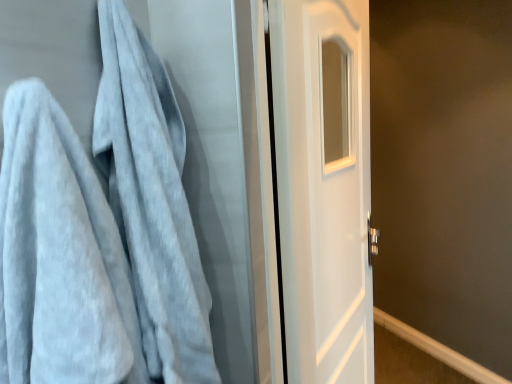
Measure the distance between point (82, 184) and camera.

Point (82, 184) and camera are 24.02 inches apart.

Measure the distance between light gray plush towel at left and camera.

They are 51.36 centimeters apart.

Image resolution: width=512 pixels, height=384 pixels. What are the coordinates of `light gray plush towel at left` in the screenshot? It's located at (101, 231).

The width and height of the screenshot is (512, 384). What do you see at coordinates (101, 231) in the screenshot?
I see `light gray plush towel at left` at bounding box center [101, 231].

The image size is (512, 384). In order to click on white glossy door at center in this screenshot , I will do `click(323, 187)`.

Describe the element at coordinates (323, 187) in the screenshot. This screenshot has height=384, width=512. I see `white glossy door at center` at that location.

Identify the location of light gray plush towel at left. This screenshot has width=512, height=384. (101, 231).

Considering the relative positions of white glossy door at center and light gray plush towel at left in the image provided, is white glossy door at center to the left of light gray plush towel at left from the viewer's perspective?

No, white glossy door at center is not to the left of light gray plush towel at left.

Which object is further away from the camera, white glossy door at center or light gray plush towel at left?

Positioned behind is white glossy door at center.

Is point (332, 108) farther from camera compared to point (40, 241)?

Yes, it is.

From the image's perspective, which one is positioned lower, white glossy door at center or light gray plush towel at left?

white glossy door at center is shown below in the image.

From a real-world perspective, who is located higher, white glossy door at center or light gray plush towel at left?

In real-world perspective, light gray plush towel at left is above.

Which of these two, white glossy door at center or light gray plush towel at left, is wider?

Wider between the two is light gray plush towel at left.

Is white glossy door at center taller or shorter than light gray plush towel at left?

Considering their sizes, white glossy door at center has more height than light gray plush towel at left.

In the scene shown: Between white glossy door at center and light gray plush towel at left, which one has smaller size?

With smaller size is light gray plush towel at left.

Is white glossy door at center inside the boundaries of light gray plush towel at left, or outside?

white glossy door at center lies outside light gray plush towel at left.

Is there a large distance between white glossy door at center and light gray plush towel at left?

white glossy door at center is actually quite close to light gray plush towel at left.

In the scene shown: Could you tell me if white glossy door at center is turned towards light gray plush towel at left?

No, white glossy door at center does not turn towards light gray plush towel at left.

The width and height of the screenshot is (512, 384). What are the coordinates of `towel lying in front of the white glossy door at center` in the screenshot? It's located at (101, 231).

Does light gray plush towel at left appear on the right side of white glossy door at center?

No, light gray plush towel at left is not to the right of white glossy door at center.

Considering the positions of objects light gray plush towel at left and white glossy door at center in the image provided, who is behind, light gray plush towel at left or white glossy door at center?

white glossy door at center is further from the camera.

Does point (114, 103) come farther from viewer compared to point (355, 380)?

That is False.

From the image's perspective, which is below, light gray plush towel at left or white glossy door at center?

white glossy door at center is shown below in the image.

From a real-world perspective, which is physically above, light gray plush towel at left or white glossy door at center?

light gray plush towel at left.

Which of these two, light gray plush towel at left or white glossy door at center, is thinner?

Thinner between the two is white glossy door at center.

In the scene shown: Who is shorter, light gray plush towel at left or white glossy door at center?

light gray plush towel at left is shorter.

Based on their sizes in the image, would you say light gray plush towel at left is bigger or smaller than white glossy door at center?

In the image, light gray plush towel at left appears to be smaller than white glossy door at center.

Is white glossy door at center completely or partially inside light gray plush towel at left?

That's incorrect, white glossy door at center is not inside light gray plush towel at left.

Does light gray plush towel at left touch white glossy door at center?

No, light gray plush towel at left is not next to white glossy door at center.

Based on the photo, is white glossy door at center at the back of light gray plush towel at left?

No, light gray plush towel at left's orientation is not away from white glossy door at center.

Where is `towel in front of the white glossy door at center`? The image size is (512, 384). towel in front of the white glossy door at center is located at coordinates (101, 231).

Where is `door behind the light gray plush towel at left`? door behind the light gray plush towel at left is located at coordinates (323, 187).

The height and width of the screenshot is (384, 512). What are the coordinates of `door lying below the light gray plush towel at left (from the image's perspective)` in the screenshot? It's located at (323, 187).